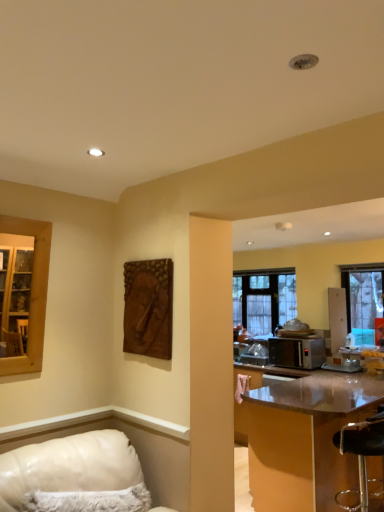
Question: Is clear glass window at center, marked as the second window in a right-to-left arrangement, taller than transparent plastic bar stool at lower right?

Choices:
 (A) yes
 (B) no

Answer: (A)

Question: Does clear glass window at center, which is the 2th window from front to back, have a lesser height compared to transparent plastic bar stool at lower right?

Choices:
 (A) no
 (B) yes

Answer: (A)

Question: Is clear glass window at center, acting as the 1th window starting from the left, smaller than transparent plastic bar stool at lower right?

Choices:
 (A) no
 (B) yes

Answer: (B)

Question: Is transparent plastic bar stool at lower right at the back of clear glass window at center, positioned as the first window in back-to-front order?

Choices:
 (A) yes
 (B) no

Answer: (B)

Question: Is clear glass window at center, positioned as the first window in back-to-front order, in contact with transparent plastic bar stool at lower right?

Choices:
 (A) no
 (B) yes

Answer: (A)

Question: Is clear glass window at center, positioned as the first window in back-to-front order, in front of transparent plastic bar stool at lower right?

Choices:
 (A) no
 (B) yes

Answer: (A)

Question: Is transparent plastic bar stool at lower right oriented away from satin silver microwave at right?

Choices:
 (A) yes
 (B) no

Answer: (B)

Question: Can you confirm if transparent plastic bar stool at lower right is thinner than satin silver microwave at right?

Choices:
 (A) yes
 (B) no

Answer: (A)

Question: Can you confirm if transparent plastic bar stool at lower right is positioned to the right of satin silver microwave at right?

Choices:
 (A) no
 (B) yes

Answer: (B)

Question: Is transparent plastic bar stool at lower right far away from satin silver microwave at right?

Choices:
 (A) no
 (B) yes

Answer: (B)

Question: Considering the relative sizes of transparent plastic bar stool at lower right and satin silver microwave at right in the image provided, is transparent plastic bar stool at lower right bigger than satin silver microwave at right?

Choices:
 (A) yes
 (B) no

Answer: (A)

Question: Is transparent plastic bar stool at lower right in contact with satin silver microwave at right?

Choices:
 (A) no
 (B) yes

Answer: (A)

Question: Considering the relative sizes of shiny brown table at right and brown textured wood at upper center in the image provided, is shiny brown table at right smaller than brown textured wood at upper center?

Choices:
 (A) yes
 (B) no

Answer: (B)